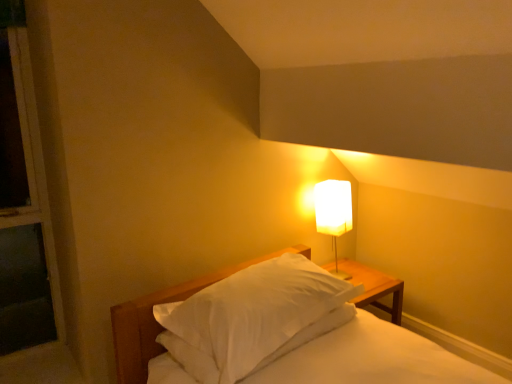
Question: Considering the relative sizes of white matte bed at center and white fabric lampshade at upper right in the image provided, is white matte bed at center shorter than white fabric lampshade at upper right?

Choices:
 (A) yes
 (B) no

Answer: (B)

Question: Is white matte bed at center looking in the opposite direction of white fabric lampshade at upper right?

Choices:
 (A) yes
 (B) no

Answer: (B)

Question: Is white matte bed at center outside white fabric lampshade at upper right?

Choices:
 (A) yes
 (B) no

Answer: (A)

Question: Can you confirm if white matte bed at center is thinner than white fabric lampshade at upper right?

Choices:
 (A) yes
 (B) no

Answer: (B)

Question: Is white matte bed at center closer to the viewer compared to white fabric lampshade at upper right?

Choices:
 (A) no
 (B) yes

Answer: (B)

Question: From the image's perspective, relative to white matte bed at center, is white soft pillow at center above or below?

Choices:
 (A) below
 (B) above

Answer: (B)

Question: Based on their positions, is white soft pillow at center located to the left or right of white matte bed at center?

Choices:
 (A) right
 (B) left

Answer: (B)

Question: From a real-world perspective, relative to white matte bed at center, is white soft pillow at center vertically above or below?

Choices:
 (A) above
 (B) below

Answer: (A)

Question: Is point (268, 259) closer or farther from the camera than point (137, 329)?

Choices:
 (A) closer
 (B) farther

Answer: (B)

Question: Is white fabric lampshade at upper right situated inside white matte bed at center or outside?

Choices:
 (A) inside
 (B) outside

Answer: (B)

Question: From their relative heights in the image, would you say white fabric lampshade at upper right is taller or shorter than white matte bed at center?

Choices:
 (A) short
 (B) tall

Answer: (A)

Question: From the image's perspective, relative to white matte bed at center, is white fabric lampshade at upper right above or below?

Choices:
 (A) below
 (B) above

Answer: (B)

Question: Considering their positions, is white fabric lampshade at upper right located in front of or behind white matte bed at center?

Choices:
 (A) front
 (B) behind

Answer: (B)

Question: Is white soft pillow at center situated inside white fabric lampshade at upper right or outside?

Choices:
 (A) inside
 (B) outside

Answer: (B)

Question: From the image's perspective, is white soft pillow at center located above or below white fabric lampshade at upper right?

Choices:
 (A) above
 (B) below

Answer: (B)